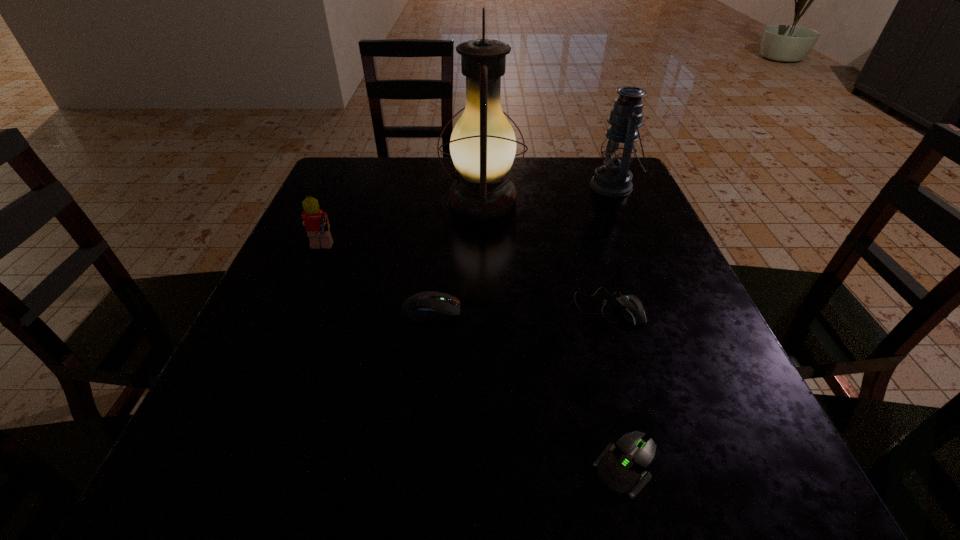
Find the location of a particular element. This screenshot has width=960, height=540. vacant space situated on the front-facing side of the lantern is located at coordinates (474, 186).

The width and height of the screenshot is (960, 540). I want to click on free space located in front of the third farthest object with the accessory visible, so tap(405, 251).

At what (x,y) coordinates should I click in order to perform the action: click on vacant space situated on the button of the leftmost computer mouse. Please return your answer as a coordinate pair (x, y). Looking at the image, I should click on (489, 311).

Where is `vacant region located on the left of the nearest object`? This screenshot has height=540, width=960. vacant region located on the left of the nearest object is located at coordinates (x=447, y=466).

This screenshot has height=540, width=960. In order to click on oil lamp that is at the far edge in this screenshot , I will do `click(483, 145)`.

In order to click on lantern located in the far edge section of the desktop in this screenshot , I will do `click(613, 179)`.

Find the location of a particular element. This screenshot has height=540, width=960. object at the near edge is located at coordinates (621, 467).

At what (x,y) coordinates should I click in order to perform the action: click on object located at the left edge. Please return your answer as a coordinate pair (x, y). This screenshot has width=960, height=540. Looking at the image, I should click on (316, 222).

Find the location of `lantern that is at the right edge`. lantern that is at the right edge is located at coordinates (613, 179).

Locate an element on the screen. The width and height of the screenshot is (960, 540). object that is at the far right corner is located at coordinates (613, 179).